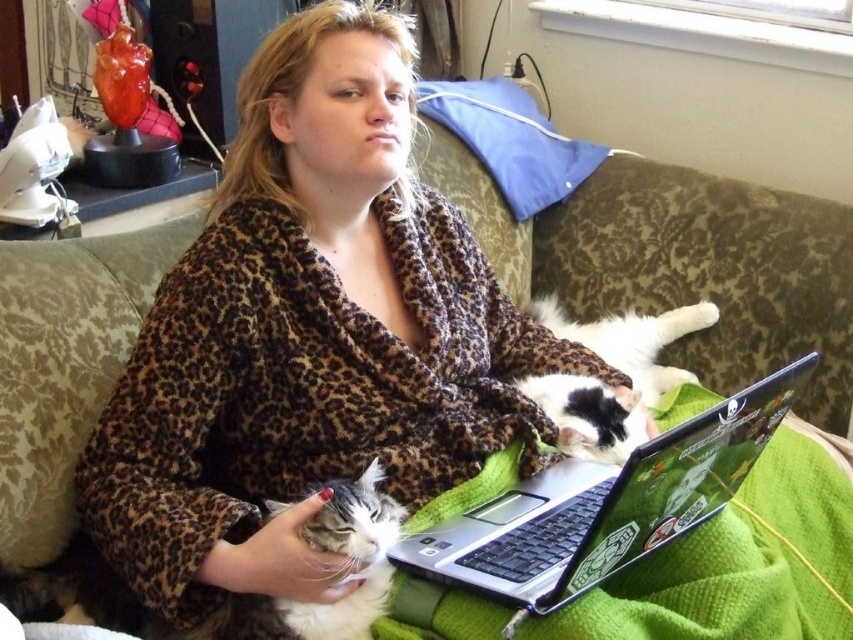
You are a fashion designer analyzing the image. You need to place a new accessory exactly at the center of the leopard print robe at center. What coordinates should you use?

The leopard print robe at center is positioned at coordinates point (310, 337), so you should place the accessory at those coordinates.

You are a photographer trying to capture a closeup of the leopard print robe at center. The camera is 37.83 inches away from the robe. Is this distance suitable for a clear closeup shot?

The leopard print robe at center and camera are 37.83 inches apart from each other. This distance may be too far for a clear closeup shot, as closeups typically require the camera to be much closer to the subject.